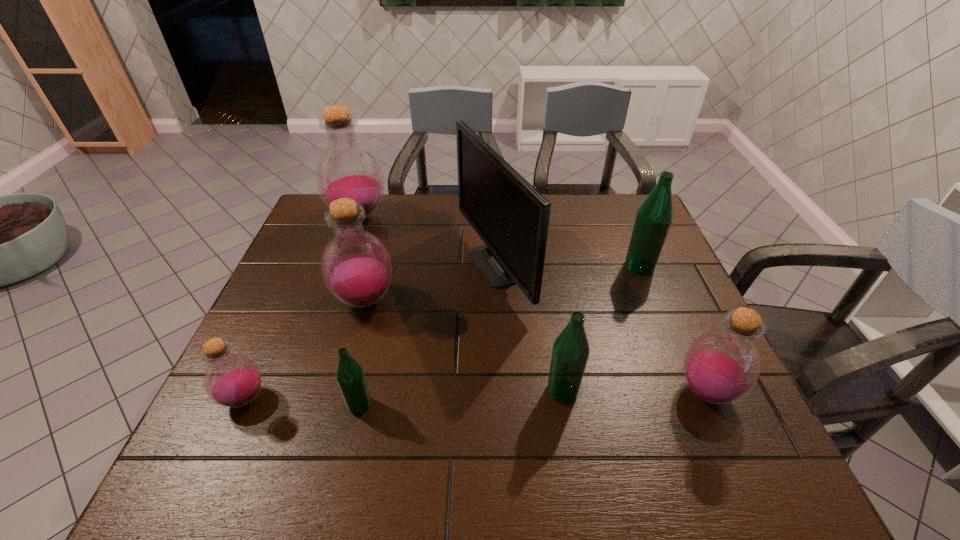
Locate an element on the screen. The width and height of the screenshot is (960, 540). the leftmost green bottle is located at coordinates (350, 377).

Identify the location of the smallest purple bottle. (232, 380).

I want to click on blank space located 0.080m on the right of the biggest purple bottle, so click(x=414, y=216).

Where is `vacant region located on the front-facing side of the computer monitor`? vacant region located on the front-facing side of the computer monitor is located at coordinates (385, 266).

The height and width of the screenshot is (540, 960). Find the location of `free space located on the front-facing side of the computer monitor`. free space located on the front-facing side of the computer monitor is located at coordinates (402, 266).

Image resolution: width=960 pixels, height=540 pixels. Identify the location of free point located 0.160m on the front-facing side of the computer monitor. (402, 266).

Find the location of a particular element. The width and height of the screenshot is (960, 540). free space located 0.390m on the front of the farthest green bottle is located at coordinates (692, 396).

Find the location of `vacant area situated on the right of the second biggest purple bottle`. vacant area situated on the right of the second biggest purple bottle is located at coordinates (465, 300).

At what (x,y) coordinates should I click in order to perform the action: click on blank space located on the left of the second smallest green bottle. Please return your answer as a coordinate pair (x, y). Looking at the image, I should click on (392, 390).

This screenshot has height=540, width=960. In order to click on free space located 0.230m on the back of the third biggest purple bottle in this screenshot , I will do `click(663, 296)`.